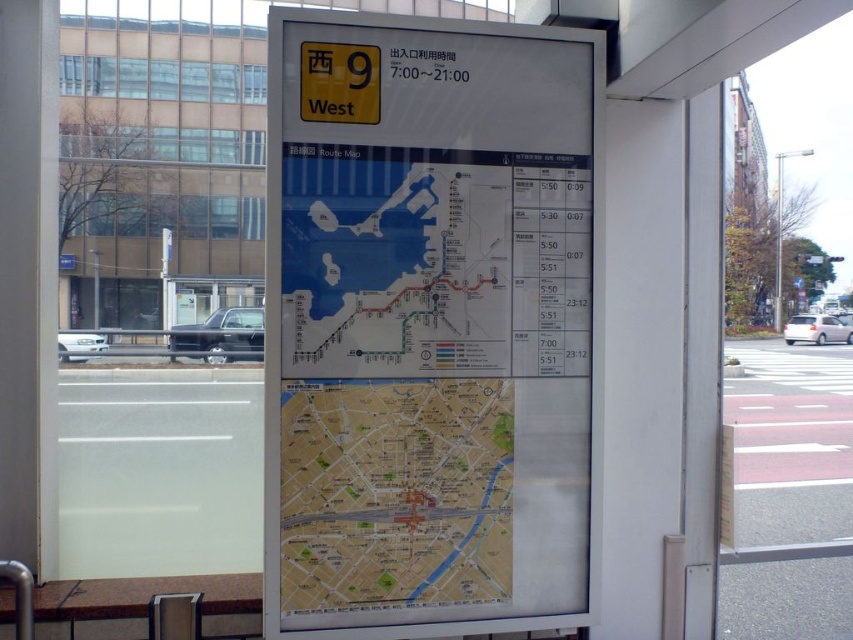
You are at a station platform and need to find the bus schedule. You see a white paper map at center and a yellow paper map at center. Which one is positioned more to the left?

The yellow paper map at center is positioned more to the left since the white paper map at center is to its right.